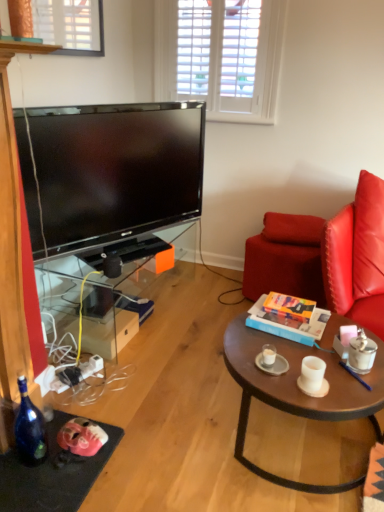
Question: Does red leather pillow at right have a larger size compared to black plastic pen at center?

Choices:
 (A) yes
 (B) no

Answer: (A)

Question: Is red leather pillow at right next to black plastic pen at center and touching it?

Choices:
 (A) yes
 (B) no

Answer: (B)

Question: Is red leather pillow at right behind black plastic pen at center?

Choices:
 (A) no
 (B) yes

Answer: (B)

Question: Is the position of red leather pillow at right less distant than that of black plastic pen at center?

Choices:
 (A) yes
 (B) no

Answer: (B)

Question: Is red leather pillow at right facing towards black plastic pen at center?

Choices:
 (A) yes
 (B) no

Answer: (A)

Question: Would you say hardcover book at center is inside or outside red leather pillow at right?

Choices:
 (A) outside
 (B) inside

Answer: (A)

Question: Considering the positions of hardcover book at center and red leather pillow at right in the image, is hardcover book at center taller or shorter than red leather pillow at right?

Choices:
 (A) tall
 (B) short

Answer: (B)

Question: Is hardcover book at center in front of or behind red leather pillow at right in the image?

Choices:
 (A) behind
 (B) front

Answer: (B)

Question: From a real-world perspective, is hardcover book at center physically located above or below red leather pillow at right?

Choices:
 (A) below
 (B) above

Answer: (A)

Question: Is point (269, 359) closer or farther from the camera than point (120, 265)?

Choices:
 (A) farther
 (B) closer

Answer: (B)

Question: Is white matte coffee cup at center, the third coffee cup positioned from the right, in front of or behind black matte speaker at lower left in the image?

Choices:
 (A) behind
 (B) front

Answer: (B)

Question: Is white matte coffee cup at center, acting as the 1th coffee cup starting from the left, wider or thinner than black matte speaker at lower left?

Choices:
 (A) thin
 (B) wide

Answer: (A)

Question: From a real-world perspective, is white matte coffee cup at center, the third coffee cup positioned from the right, above or below black matte speaker at lower left?

Choices:
 (A) above
 (B) below

Answer: (B)

Question: Relative to brown wooden coffee table at center, is matte gray saucer at center in front or behind?

Choices:
 (A) front
 (B) behind

Answer: (B)

Question: Based on their sizes in the image, would you say matte gray saucer at center is bigger or smaller than brown wooden coffee table at center?

Choices:
 (A) small
 (B) big

Answer: (A)